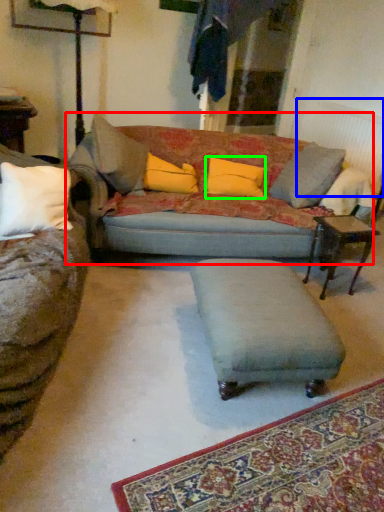
Question: Which object is positioned farthest from studio couch (highlighted by a red box)? Select from radiator (highlighted by a blue box) and pillow (highlighted by a green box).

Choices:
 (A) radiator
 (B) pillow

Answer: (A)